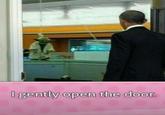
The width and height of the screenshot is (165, 115). What are the coordinates of `pink bar` in the screenshot? It's located at (78, 111).